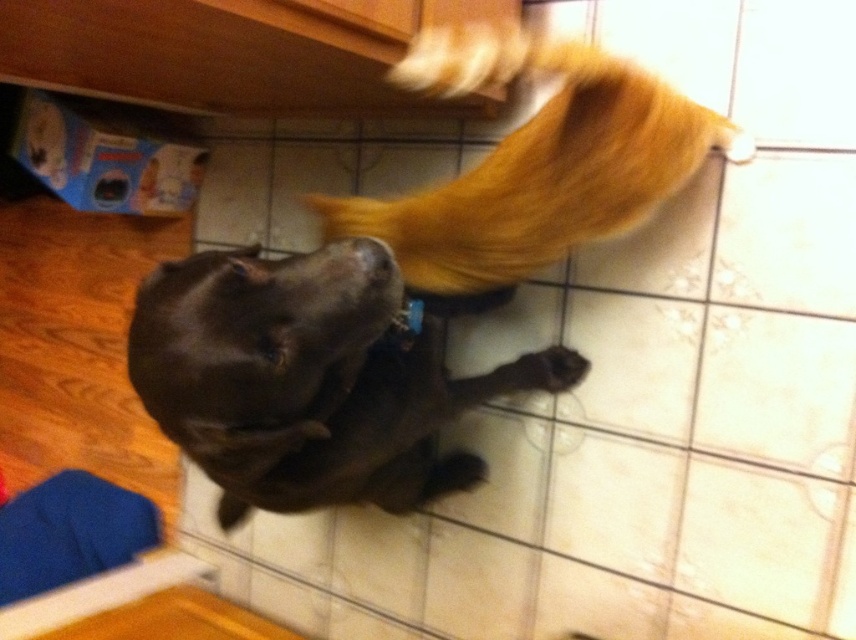
Is point (370, 224) positioned before point (584, 356)?

Yes.

Consider the image. Is brown fur dog at upper center to the left of brown fur paw at lower center from the viewer's perspective?

Indeed, brown fur dog at upper center is positioned on the left side of brown fur paw at lower center.

Is point (531, 61) less distant than point (550, 378)?

Yes, it is in front of point (550, 378).

Locate an element on the screen. This screenshot has height=640, width=856. brown fur dog at upper center is located at coordinates (535, 161).

Can you confirm if brown fur dog at upper center is wider than white glossy tile at lower right?

Correct, the width of brown fur dog at upper center exceeds that of white glossy tile at lower right.

Does point (525, 228) lie behind point (652, 365)?

No.

I want to click on brown fur dog at upper center, so click(x=535, y=161).

Which is above, white glossy tile at lower right or brown fur paw at lower center?

white glossy tile at lower right is above.

Is the position of white glossy tile at lower right more distant than that of brown fur paw at lower center?

That is False.

Is point (675, 392) behind point (545, 376)?

No, (675, 392) is closer to viewer.

Locate an element on the screen. This screenshot has height=640, width=856. white glossy tile at lower right is located at coordinates (635, 358).